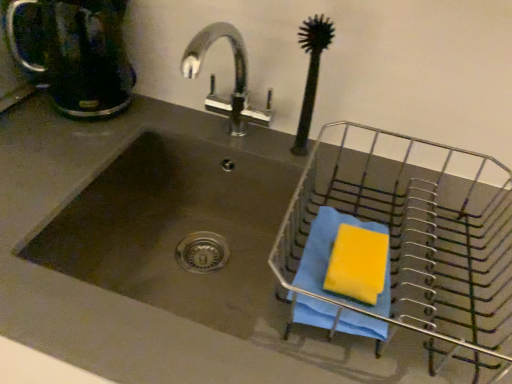
At what (x,y) coordinates should I click in order to perform the action: click on free space in front of matte black coffeepot at upper left. Please return your answer as a coordinate pair (x, y). Image resolution: width=512 pixels, height=384 pixels. Looking at the image, I should click on (x=55, y=151).